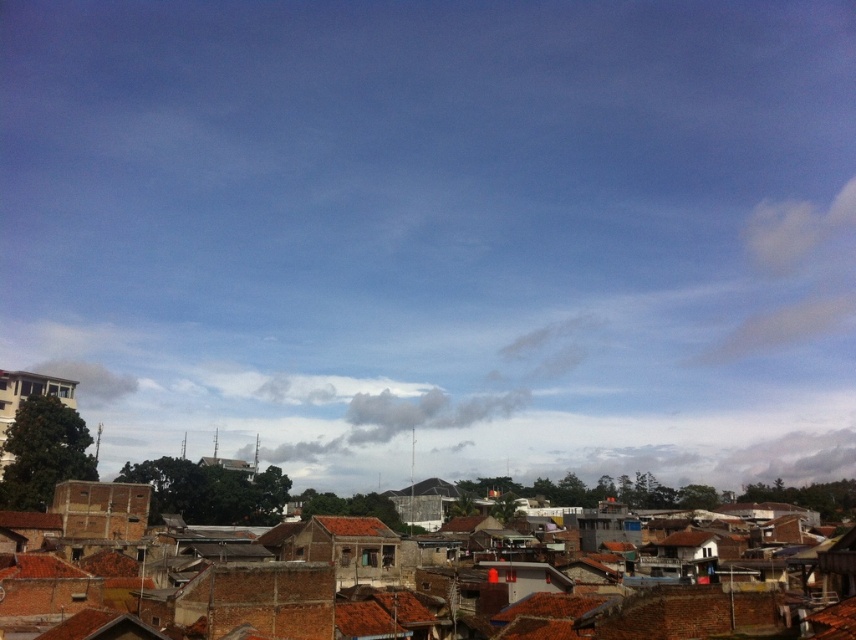
Question: Which point is closer to the camera?

Choices:
 (A) (357, 524)
 (B) (183, 483)

Answer: (A)

Question: Is brown clay rooftops at center wider than brown tile roof at center?

Choices:
 (A) yes
 (B) no

Answer: (A)

Question: Which object appears farthest from the camera in this image?

Choices:
 (A) brown tile roof at center
 (B) brown clay rooftops at center

Answer: (B)

Question: Which object is closer to the camera taking this photo?

Choices:
 (A) brown clay rooftops at center
 (B) brown tile roof at center

Answer: (B)

Question: Does brown clay rooftops at center appear on the left side of brown tile roof at center?

Choices:
 (A) yes
 (B) no

Answer: (B)

Question: Is brown clay rooftops at center above brown tile roof at center?

Choices:
 (A) yes
 (B) no

Answer: (B)